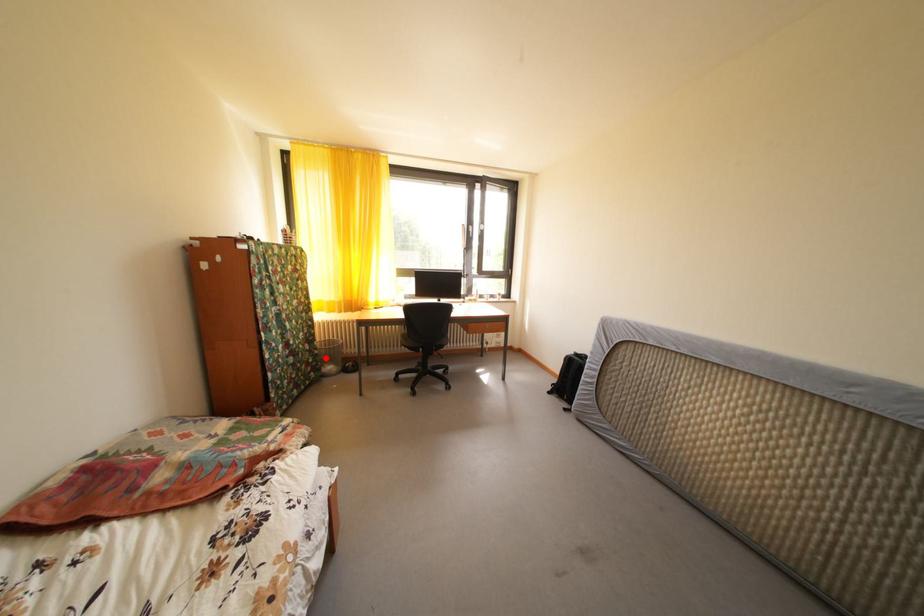
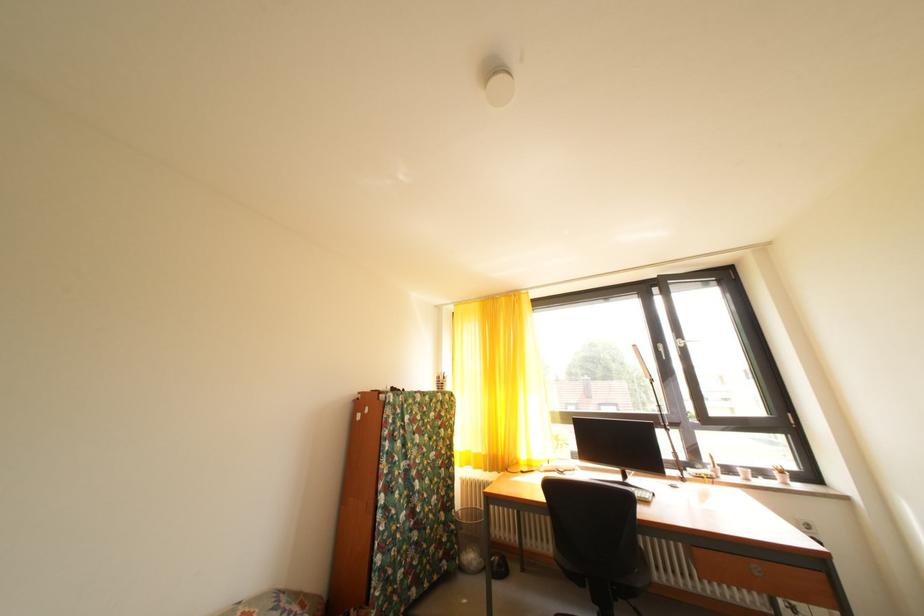
Find the pixel in the second image that matches the highlighted location in the first image.

(462, 533)